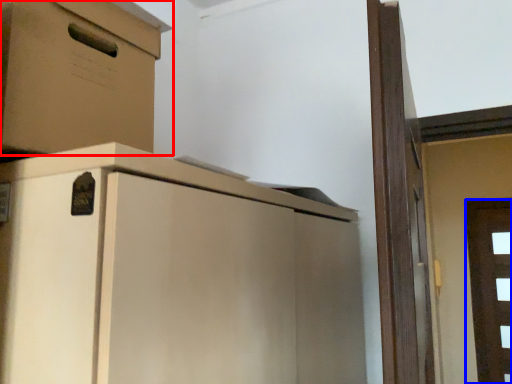
Question: Which object is further to the camera taking this photo, cabinetry (highlighted by a red box) or door (highlighted by a blue box)?

Choices:
 (A) cabinetry
 (B) door

Answer: (B)